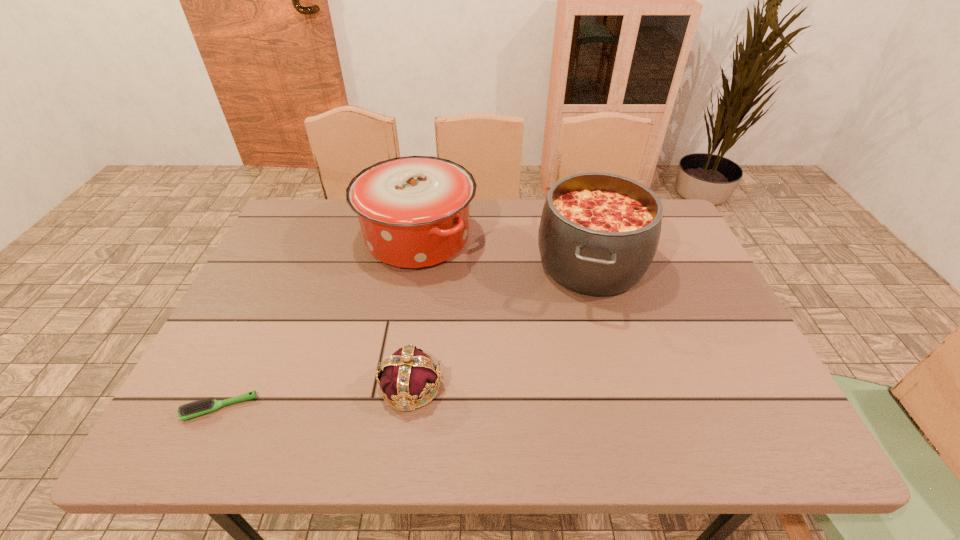
Locate which object is the second closest to the left casserole. Please provide its 2D coordinates. Your answer should be formatted as a tuple, i.e. [(x, y)], where the tuple contains the x and y coordinates of a point satisfying the conditions above.

[(409, 374)]

This screenshot has width=960, height=540. I want to click on object that ranks as the third closest to the right casserole, so click(x=203, y=406).

Where is `vacant point that satisfies the following two spatial constraints: 1. on the back side of the crown; 2. on the right side of the rightmost object`? This screenshot has width=960, height=540. vacant point that satisfies the following two spatial constraints: 1. on the back side of the crown; 2. on the right side of the rightmost object is located at coordinates (427, 264).